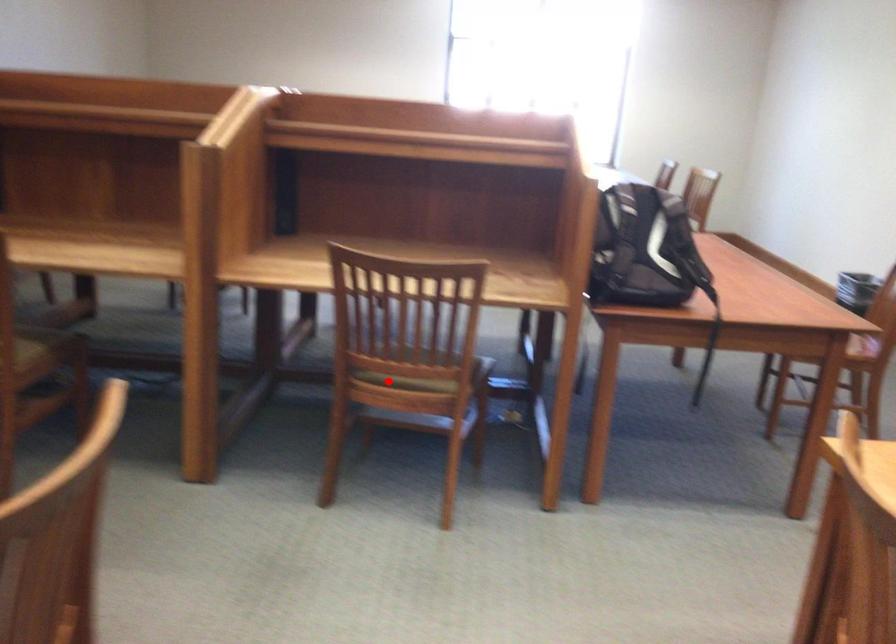
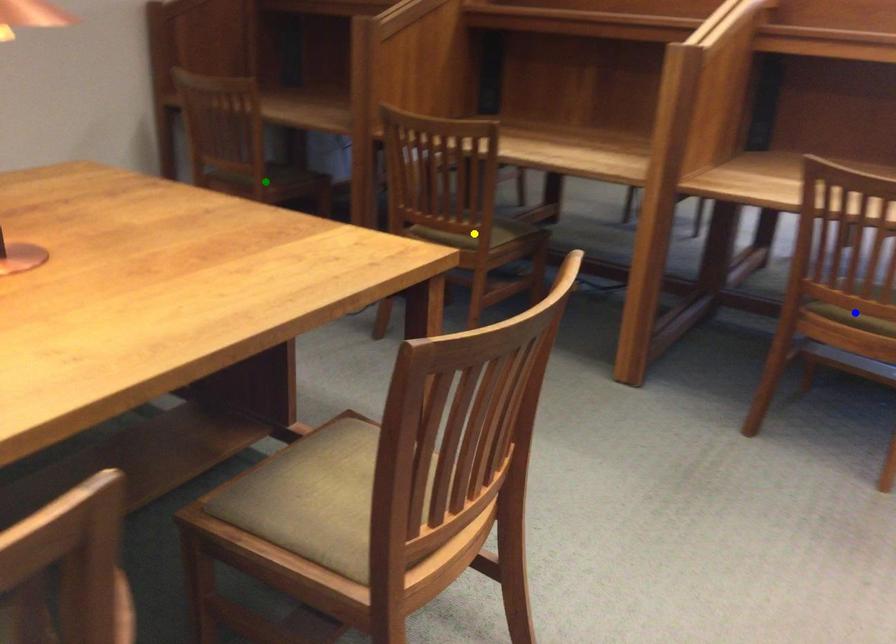
Question: I am providing you with two images of the same scene from different viewpoints. A red point is marked on the first image. You are given multiple points on the second image. In image 2, which mark is for the same physical point as the one in image 1?

Choices:
 (A) blue point
 (B) green point
 (C) yellow point

Answer: (A)